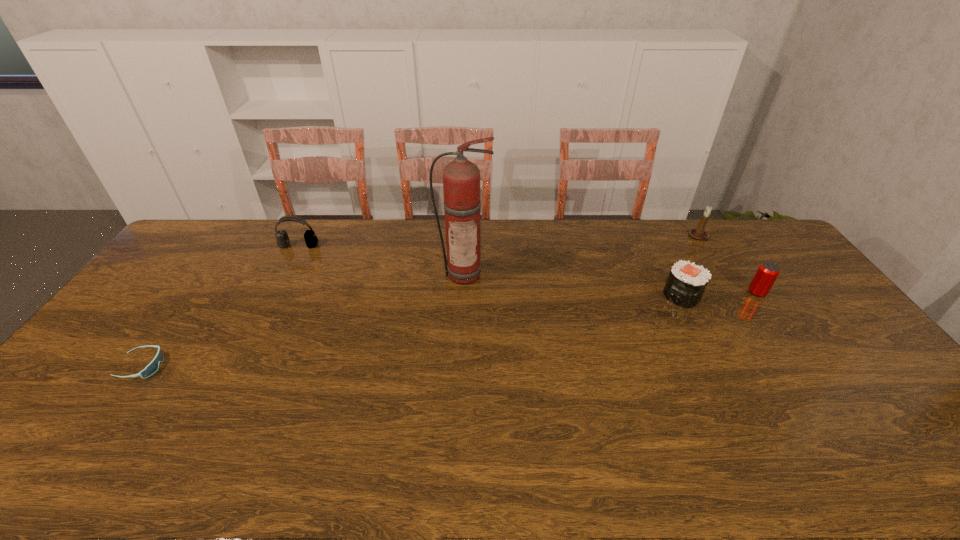
Where is `free space located 0.180m on the headband of the headset`? free space located 0.180m on the headband of the headset is located at coordinates (280, 282).

At what (x,y) coordinates should I click in order to perform the action: click on vacant space located 0.220m on the back of the can. Please return your answer as a coordinate pair (x, y). Looking at the image, I should click on (725, 246).

The image size is (960, 540). In order to click on free space located on the right of the sushi in this screenshot , I will do `click(744, 295)`.

Locate an element on the screen. vacant space located 0.170m on the front-facing side of the leftmost object is located at coordinates (225, 366).

This screenshot has width=960, height=540. I want to click on candle holder that is positioned at the far edge, so click(700, 234).

Where is `headset that is positioned at the far edge`? headset that is positioned at the far edge is located at coordinates (311, 240).

The height and width of the screenshot is (540, 960). In order to click on object located in the left edge section of the desktop in this screenshot , I will do `click(150, 369)`.

Find the location of a particular element. This screenshot has height=540, width=960. free space at the far edge of the desktop is located at coordinates coord(722,255).

Find the location of a particular element. free location at the near edge of the desktop is located at coordinates (429, 450).

At what (x,y) coordinates should I click in order to perform the action: click on vacant space at the left edge of the desktop. Please return your answer as a coordinate pair (x, y). Looking at the image, I should click on (117, 325).